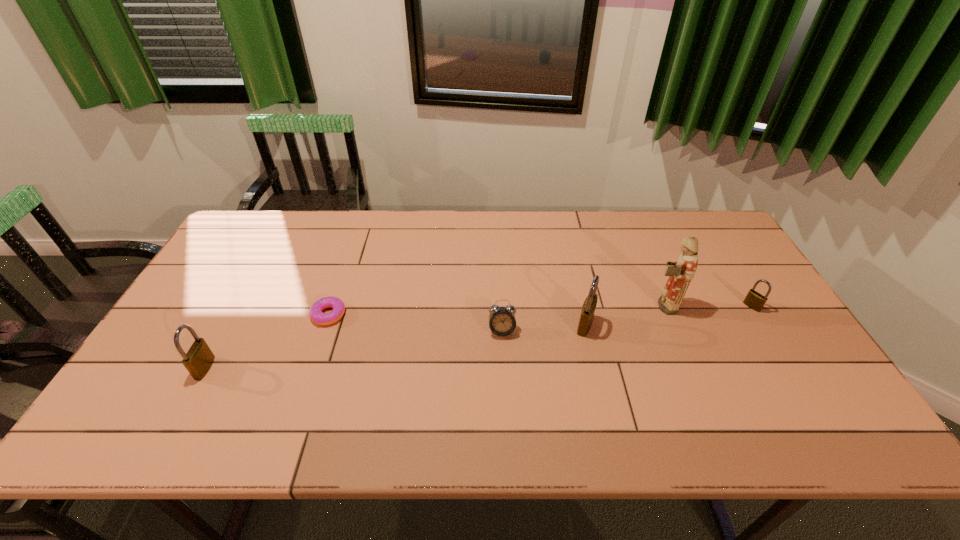
To make them evenly spaced by inserting another padlock among them, please locate a free space for this new padlock. Please provide its 2D coordinates. Your answer should be formatted as a tuple, i.e. [(x, y)], where the tuple contains the x and y coordinates of a point satisfying the conditions above.

[(403, 346)]